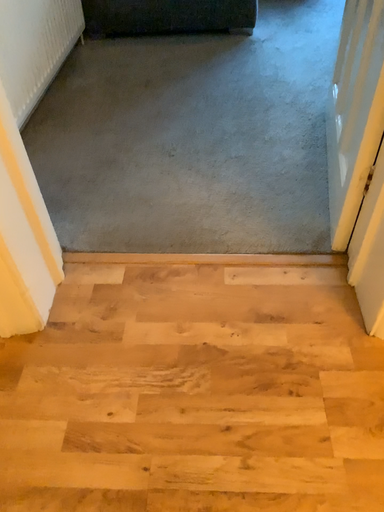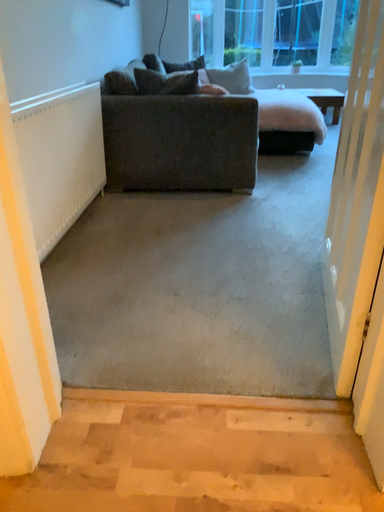
Question: Which way did the camera rotate in the video?

Choices:
 (A) rotated upward
 (B) rotated downward

Answer: (A)